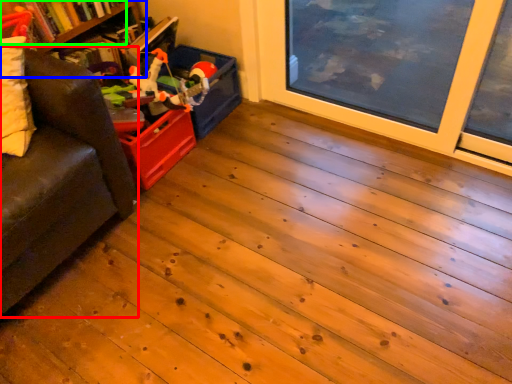
Question: Which object is positioned farthest from studio couch (highlighted by a red box)? Select from bookshelf (highlighted by a blue box) and book (highlighted by a green box).

Choices:
 (A) bookshelf
 (B) book

Answer: (A)